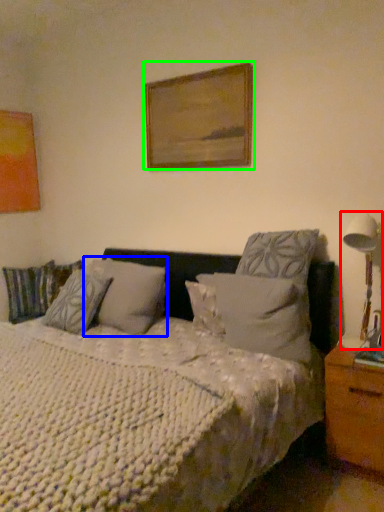
Question: Which is nearer to the table lamp (highlighted by a red box)? pillow (highlighted by a blue box) or picture frame (highlighted by a green box).

Choices:
 (A) pillow
 (B) picture frame

Answer: (B)